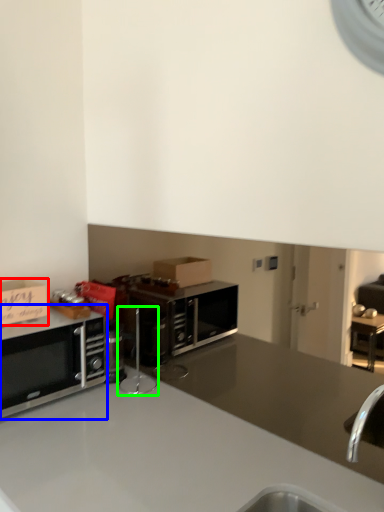
Question: Considering the real-world distances, which object is farthest from cabinetry (highlighted by a red box)? microwave oven (highlighted by a blue box) or appliance (highlighted by a green box)?

Choices:
 (A) microwave oven
 (B) appliance

Answer: (B)